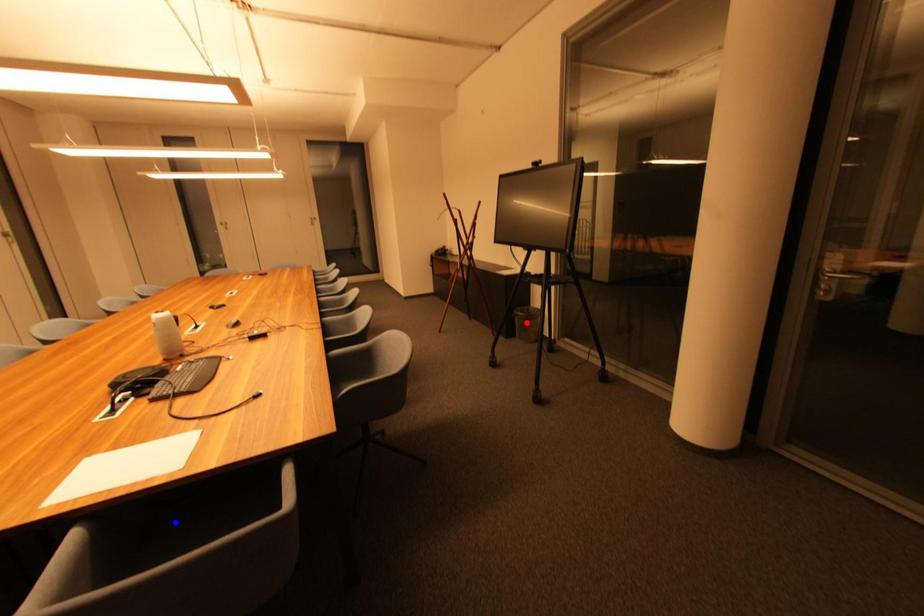
Question: Two points are marked on the image. Which point is closer to the camera?

Choices:
 (A) Blue point is closer.
 (B) Red point is closer.

Answer: (A)